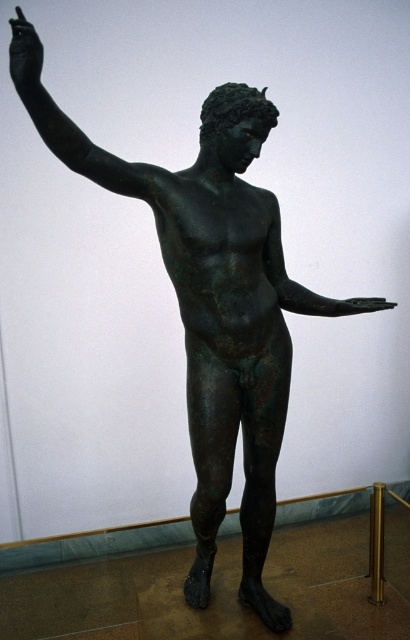
You are an art conservator examining the classical bronze statue. You notice two hands on the statue. The first is the bronze statue hand at upper left, and the second is the bronze hand at center. Which hand appears taller in the image?

The bronze statue hand at upper left appears taller than the bronze hand at center.

In the scene shown: You are an art conservator examining the classical bronze statue. You notice two parts of the statue at the upper left corner. One is the bronze arm at upper left and the other is the bronze statue hand at upper left. Which part is taller?

The bronze arm at upper left is taller than the bronze statue hand at upper left.

You are an art conservator examining the classical bronze statue. You notice a specific point at coordinates point (70, 124) on the statue. Based on the statue description, can you identify which part of the statue this point corresponds to?

The point (70, 124) marks the bronze arm at upper left.